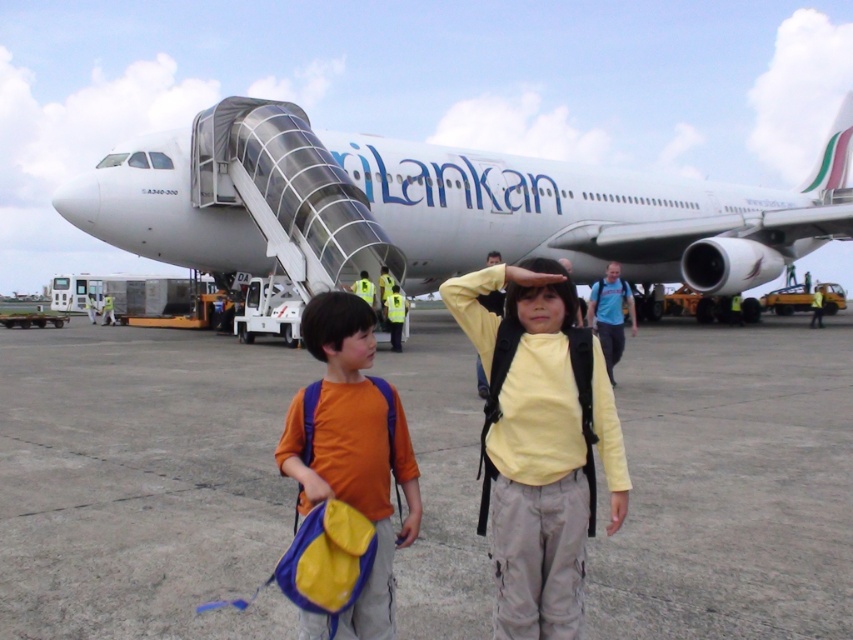
Can you confirm if white glossy airplane at center is thinner than yellow matte shirt at center?

No.

Which is more to the left, white glossy airplane at center or yellow matte shirt at center?

Positioned to the left is yellow matte shirt at center.

Is point (140, 186) farther from viewer compared to point (576, 424)?

Yes, it is behind point (576, 424).

The image size is (853, 640). In order to click on white glossy airplane at center in this screenshot , I will do `click(434, 205)`.

Does gray concrete tarmac at center have a lesser height compared to yellow matte shirt at center?

Correct, gray concrete tarmac at center is not as tall as yellow matte shirt at center.

Can you confirm if gray concrete tarmac at center is positioned above yellow matte shirt at center?

No.

Between point (792, 452) and point (492, 556), which one is positioned behind?

The point (792, 452) is more distant.

This screenshot has width=853, height=640. Find the location of `gray concrete tarmac at center`. gray concrete tarmac at center is located at coordinates (141, 481).

Between gray concrete tarmac at center and white glossy airplane at center, which one has more height?

Standing taller between the two is white glossy airplane at center.

Who is positioned more to the left, gray concrete tarmac at center or white glossy airplane at center?

gray concrete tarmac at center

I want to click on gray concrete tarmac at center, so click(141, 481).